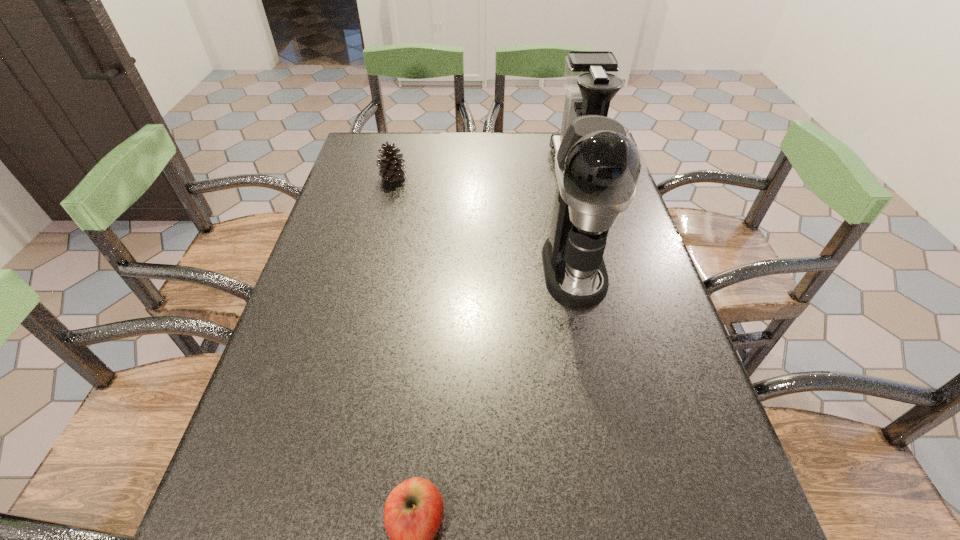
Image resolution: width=960 pixels, height=540 pixels. What are the coordinates of `free spot between the shorter coffee maker and the second shortest object` in the screenshot? It's located at (486, 173).

At what (x,y) coordinates should I click in order to perform the action: click on empty space that is in between the third tallest object and the second nearest object. Please return your answer as a coordinate pair (x, y). The height and width of the screenshot is (540, 960). Looking at the image, I should click on (483, 223).

Locate which object is the closest to the second shortest object. Please provide its 2D coordinates. Your answer should be formatted as a tuple, i.e. [(x, y)], where the tuple contains the x and y coordinates of a point satisfying the conditions above.

[(597, 167)]

Where is `object that stands as the third closest to the apple`? This screenshot has height=540, width=960. object that stands as the third closest to the apple is located at coordinates (392, 169).